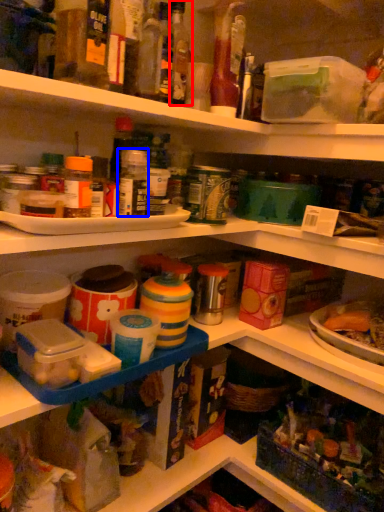
Question: Which of the following is the closest to the observer, bottle (highlighted by a red box) or bottle (highlighted by a blue box)?

Choices:
 (A) bottle
 (B) bottle

Answer: (B)